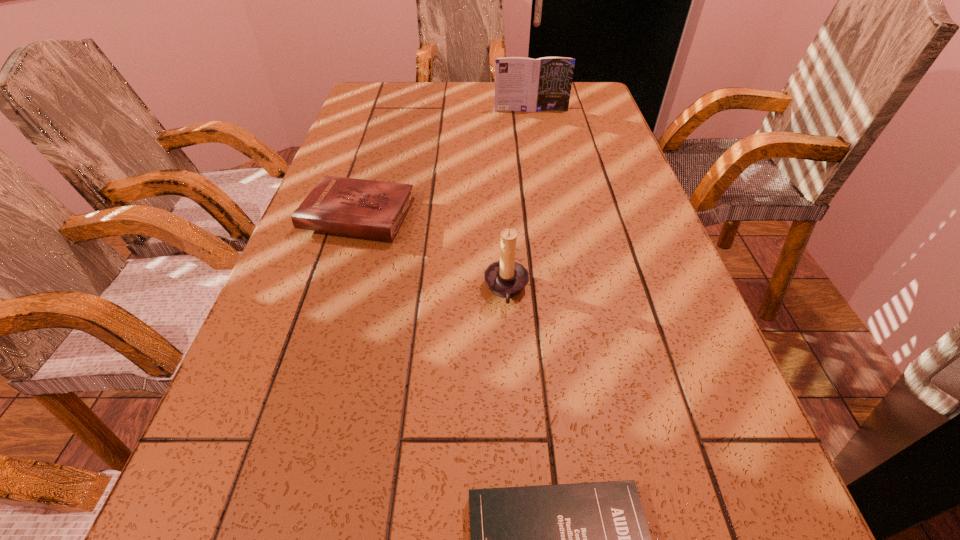
Where is `object that is at the far edge`? Image resolution: width=960 pixels, height=540 pixels. object that is at the far edge is located at coordinates (524, 84).

The image size is (960, 540). In order to click on object that is at the left edge in this screenshot , I will do coord(372,209).

At what (x,y) coordinates should I click in order to perform the action: click on object positioned at the right edge. Please return your answer as a coordinate pair (x, y). The width and height of the screenshot is (960, 540). Looking at the image, I should click on (524, 84).

This screenshot has height=540, width=960. I want to click on object that is at the far right corner, so click(524, 84).

Locate an element on the screen. free space at the far edge of the desktop is located at coordinates (452, 109).

Locate an element on the screen. This screenshot has width=960, height=540. vacant space at the left edge of the desktop is located at coordinates (355, 242).

Locate an element on the screen. vacant region at the right edge is located at coordinates (617, 194).

Find the location of `vacant space at the far left corner of the desktop`. vacant space at the far left corner of the desktop is located at coordinates (387, 85).

Where is `vacant region at the far right corner of the desktop`? vacant region at the far right corner of the desktop is located at coordinates (573, 112).

I want to click on free space that is in between the third farthest object and the farther book, so click(x=518, y=200).